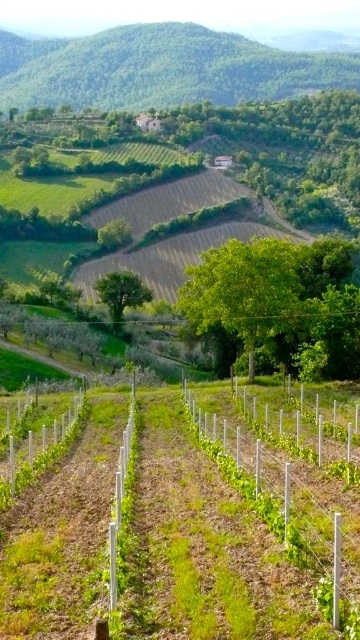
Describe the element at coordinates (160, 68) in the screenshot. The height and width of the screenshot is (640, 360). I see `green leafy hillside at upper center` at that location.

Which is in front, point (311, 52) or point (303, 532)?

Point (303, 532) is more forward.

Find the location of a particular element. This screenshot has height=640, width=360. green leafy hillside at upper center is located at coordinates (160, 68).